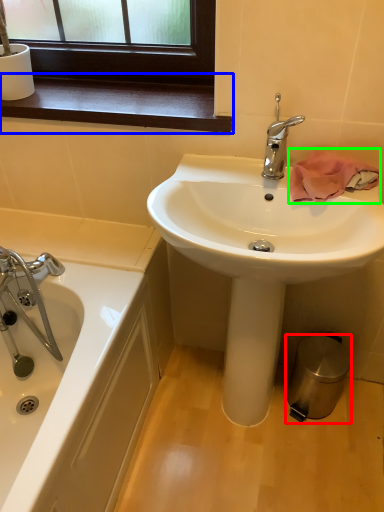
Question: Which object is positioned farthest from trash bin/can (highlighted by a red box)? Select from window sill (highlighted by a blue box) and bath towel (highlighted by a green box).

Choices:
 (A) window sill
 (B) bath towel

Answer: (A)